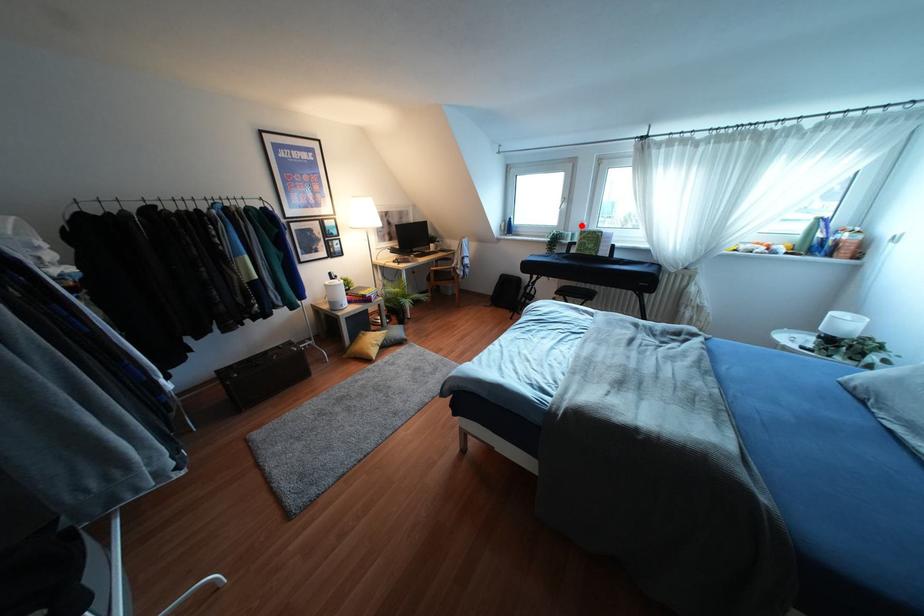
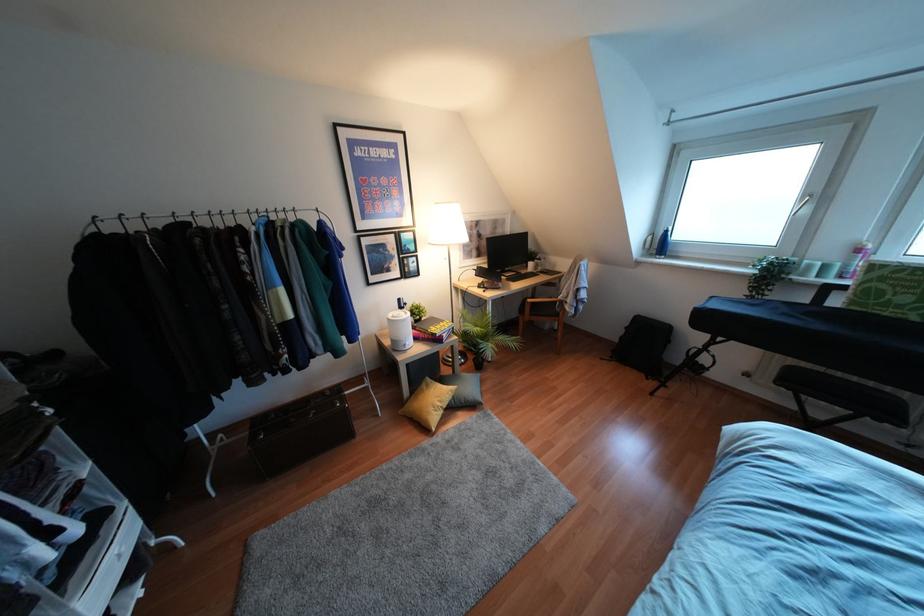
Question: I am providing you with two images of the same scene from different viewpoints. Given a red point in image1, look at the same physical point in image2. Is it:

Choices:
 (A) Closer to the viewpoint
 (B) Farther from the viewpoint

Answer: (B)